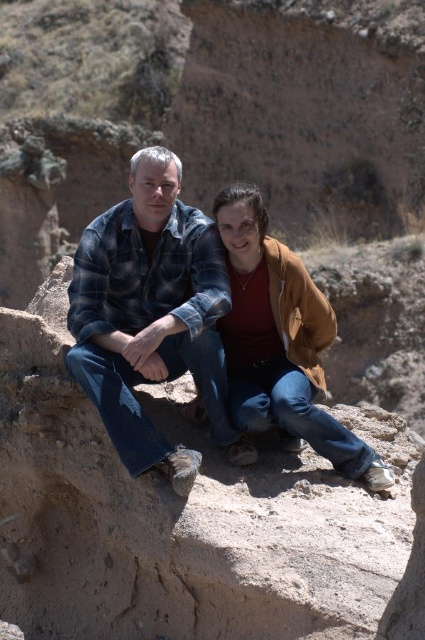
Question: Is plaid flannel shirt at center above brown suede jacket at center?

Choices:
 (A) no
 (B) yes

Answer: (B)

Question: Which object is farther from the camera taking this photo?

Choices:
 (A) plaid flannel shirt at center
 (B) brown suede jacket at center

Answer: (B)

Question: Among these objects, which one is nearest to the camera?

Choices:
 (A) plaid flannel shirt at center
 (B) brown suede jacket at center

Answer: (A)

Question: Can you confirm if plaid flannel shirt at center is smaller than brown suede jacket at center?

Choices:
 (A) yes
 (B) no

Answer: (B)

Question: Does plaid flannel shirt at center appear on the left side of brown suede jacket at center?

Choices:
 (A) yes
 (B) no

Answer: (A)